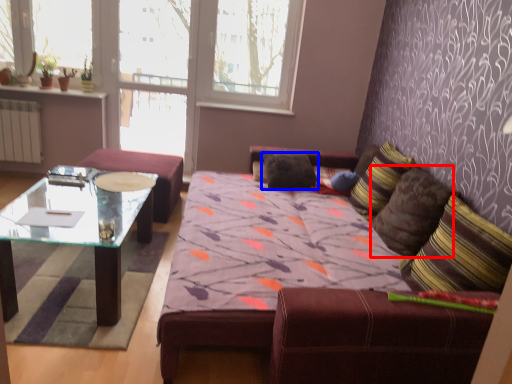
Question: Which of the following is the farthest to the observer, pillow (highlighted by a red box) or pillow (highlighted by a blue box)?

Choices:
 (A) pillow
 (B) pillow

Answer: (B)